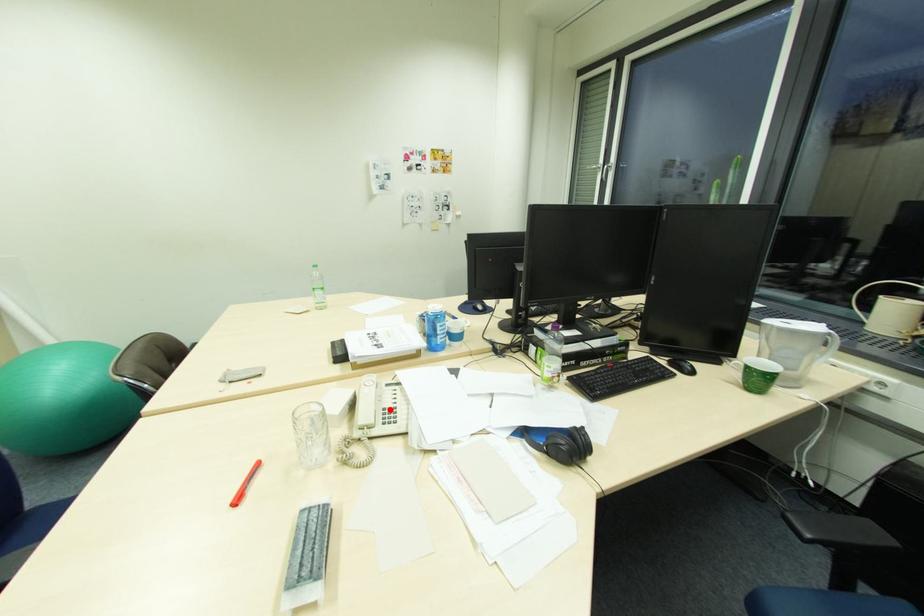
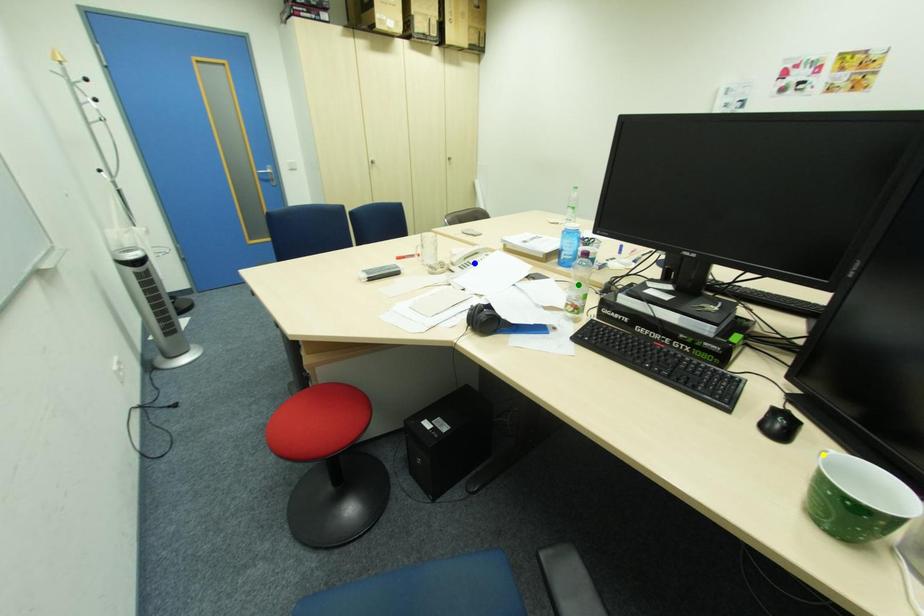
Question: I am providing you with two images of the same scene from different viewpoints. A red point is marked on the first image. You are given multiple points on the second image. Which mark in image 2 goes with the point in image 1?

Choices:
 (A) green point
 (B) yellow point
 (C) blue point

Answer: (C)